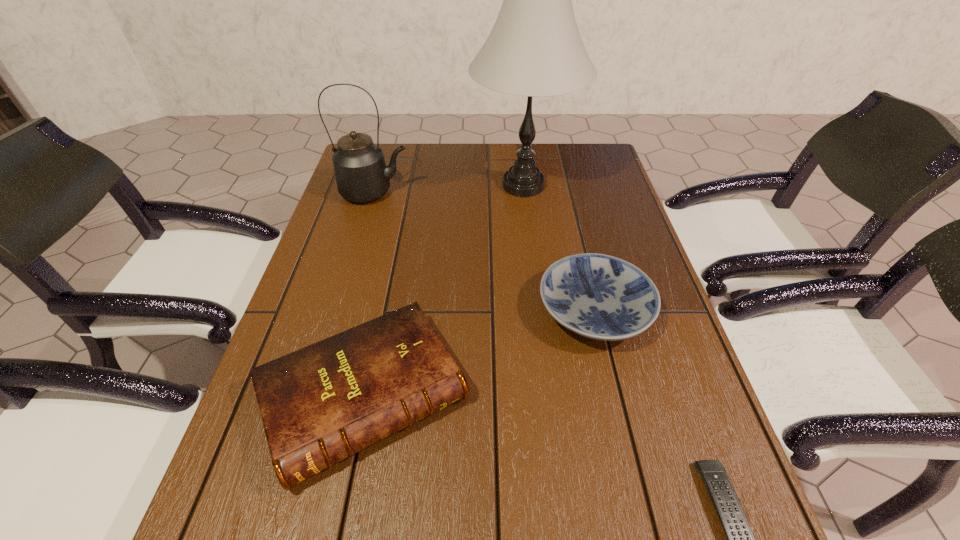
Locate an element on the screen. Image resolution: width=960 pixels, height=540 pixels. free space between the kettle and the lamp is located at coordinates (449, 189).

At what (x,y) coordinates should I click in order to perform the action: click on unoccupied position between the plate and the hardback book. Please return your answer as a coordinate pair (x, y). This screenshot has width=960, height=540. Looking at the image, I should click on [x=479, y=353].

The image size is (960, 540). Find the location of `free space between the fourth shortest object and the lamp`. free space between the fourth shortest object and the lamp is located at coordinates (449, 189).

Locate an element on the screen. vacant area between the lamp and the plate is located at coordinates (559, 248).

Identify the location of free space between the plate and the fourth shortest object. The image size is (960, 540). (485, 252).

The height and width of the screenshot is (540, 960). Find the location of `vacant space that is in between the hardback book and the tallest object`. vacant space that is in between the hardback book and the tallest object is located at coordinates (444, 291).

Where is `empty space between the tallest object and the hardback book`? Image resolution: width=960 pixels, height=540 pixels. empty space between the tallest object and the hardback book is located at coordinates (444, 291).

Locate which object ranks third in proximity to the hardback book. Please provide its 2D coordinates. Your answer should be formatted as a tuple, i.e. [(x, y)], where the tuple contains the x and y coordinates of a point satisfying the conditions above.

[(740, 539)]

Identify which object is the fourth nearest to the fourth shortest object. Please provide its 2D coordinates. Your answer should be formatted as a tuple, i.e. [(x, y)], where the tuple contains the x and y coordinates of a point satisfying the conditions above.

[(740, 539)]

Image resolution: width=960 pixels, height=540 pixels. Identify the location of vacant area that satisfies the following two spatial constraints: 1. spout on the hardback book; 2. on the left side of the second tallest object. (316, 396).